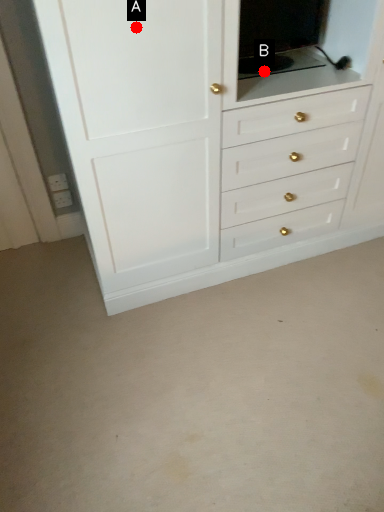
Question: Two points are circled on the image, labeled by A and B beside each circle. Which of the following is the farthest from the observer?

Choices:
 (A) A is further
 (B) B is further

Answer: (B)